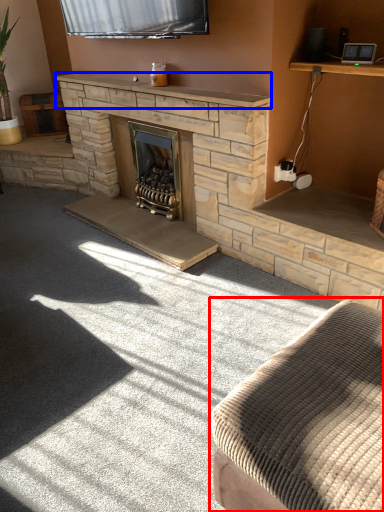
Question: Which object appears closest to the camera in this image, studio couch (highlighted by a red box) or mantle (highlighted by a blue box)?

Choices:
 (A) studio couch
 (B) mantle

Answer: (A)